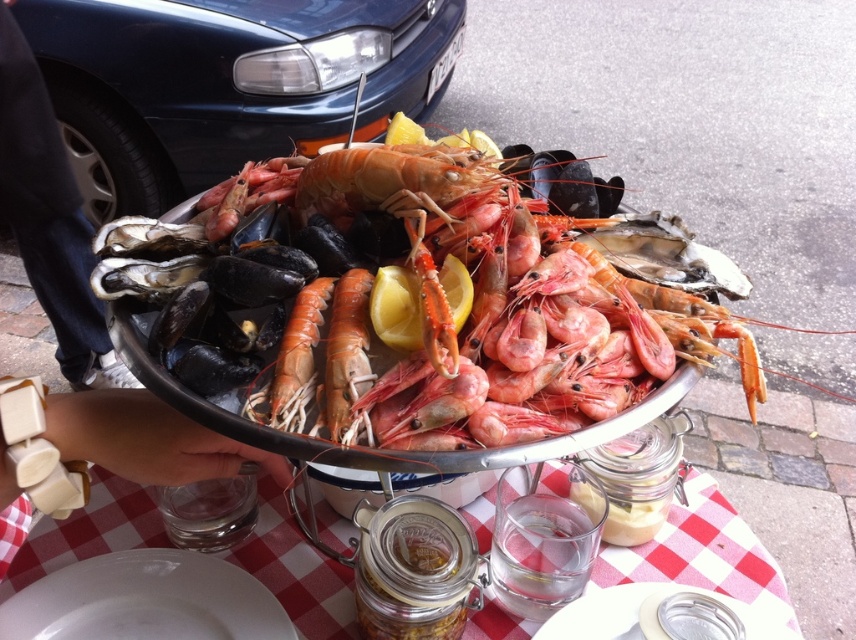
You are a food critic evaluating the presentation of this seafood platter. You notice two types of shrimp at the center. Which one is taller between the pink glossy shrimp at center and the pink matte shrimp at center?

The pink glossy shrimp at center is much taller than the pink matte shrimp at center.

Where is the pink glossy shrimp at center located in the image?

The pink glossy shrimp at center is located at point coordinates of 0.455 on the x axis and 0.482 on the y axis.